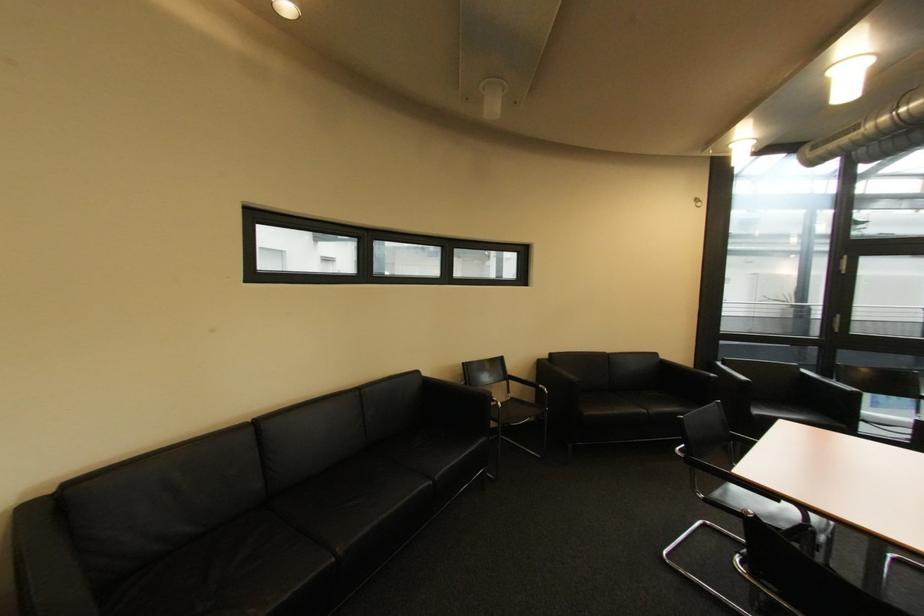
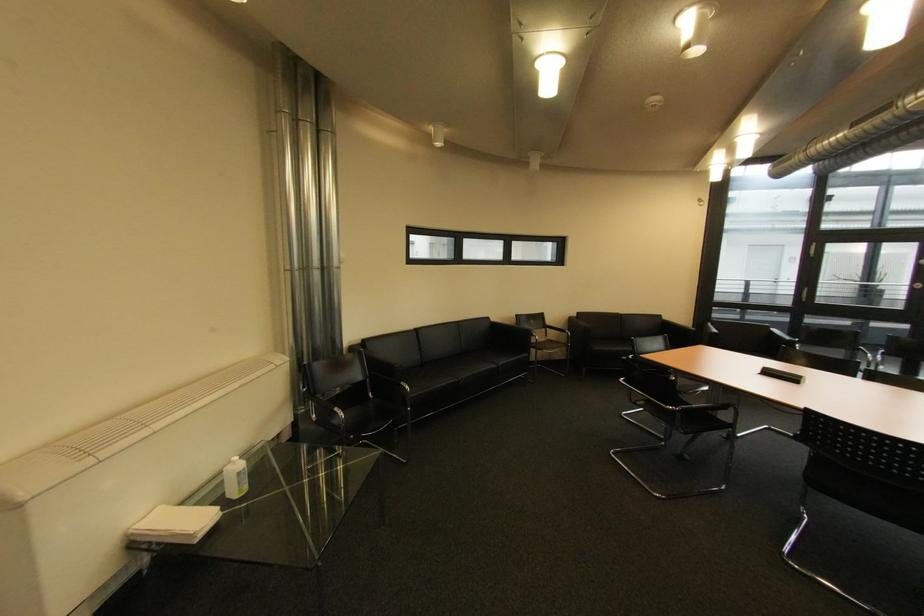
The point at (517, 382) is marked in the first image. Where is the corresponding point in the second image?

(555, 330)